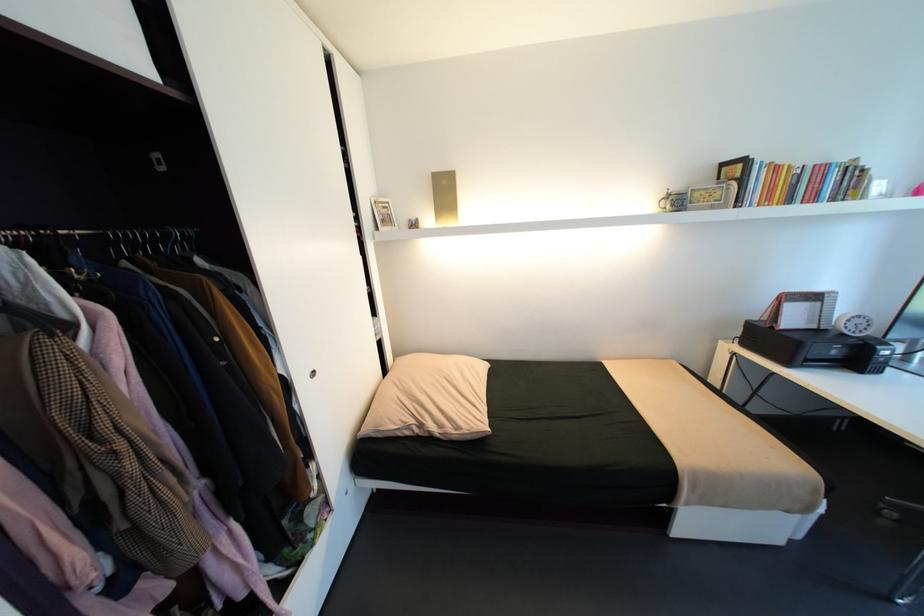
Find the location of a particular element. desk calendar is located at coordinates (801, 310).